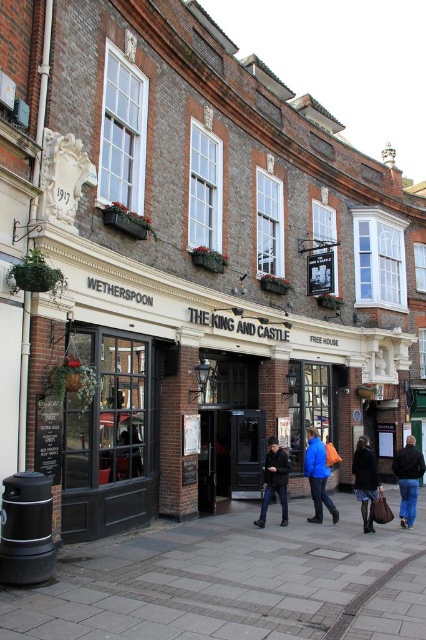
Can you confirm if blue fabric jacket at center is taller than dark blue leather jacket at center?

Indeed, blue fabric jacket at center has a greater height compared to dark blue leather jacket at center.

Is point (319, 496) closer to viewer compared to point (275, 486)?

That is False.

Find the location of `blue fabric jacket at center`. blue fabric jacket at center is located at coordinates (317, 476).

Who is lower down, gray concrete pavement at lower center or dark blue fabric coat at center?

gray concrete pavement at lower center is lower down.

Is gray concrete pavement at lower center to the left of dark blue fabric coat at center from the viewer's perspective?

Indeed, gray concrete pavement at lower center is positioned on the left side of dark blue fabric coat at center.

Which is in front, point (37, 589) or point (377, 492)?

Point (37, 589)

This screenshot has width=426, height=640. In order to click on gray concrete pavement at lower center in this screenshot , I will do `click(233, 582)`.

Can you confirm if denim jacket at lower right is positioned above dark blue leather jacket at center?

No, denim jacket at lower right is not above dark blue leather jacket at center.

Is point (400, 480) positioned behind point (264, 515)?

That is True.

Does point (391, 465) come farther from viewer compared to point (284, 458)?

Yes, it is behind point (284, 458).

Identify the location of denim jacket at lower right. (408, 480).